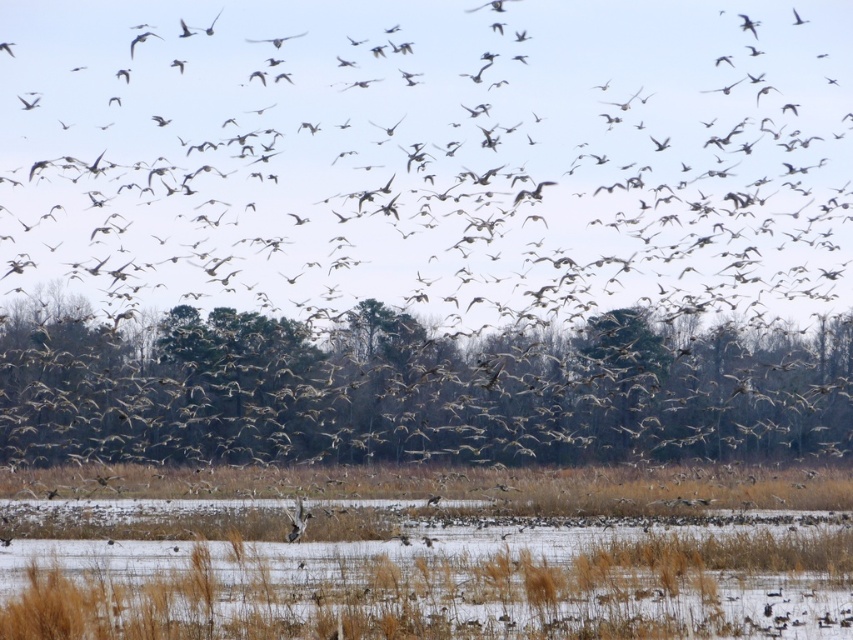
Question: Is brown feathered birds at center in front of brown feathered bird at upper left?

Choices:
 (A) yes
 (B) no

Answer: (A)

Question: Which point appears farthest from the camera in this image?

Choices:
 (A) (9, 52)
 (B) (196, 212)

Answer: (A)

Question: Does brown textured tree at center appear over brown feathered bird at upper left?

Choices:
 (A) no
 (B) yes

Answer: (A)

Question: Which point appears closest to the camera in this image?

Choices:
 (A) (13, 44)
 (B) (585, 97)

Answer: (B)

Question: Does brown feathered birds at center come in front of brown feathered bird at upper left?

Choices:
 (A) no
 (B) yes

Answer: (B)

Question: Which of the following is the farthest from the observer?

Choices:
 (A) brown grass at lower center
 (B) brown feathered birds at center

Answer: (B)